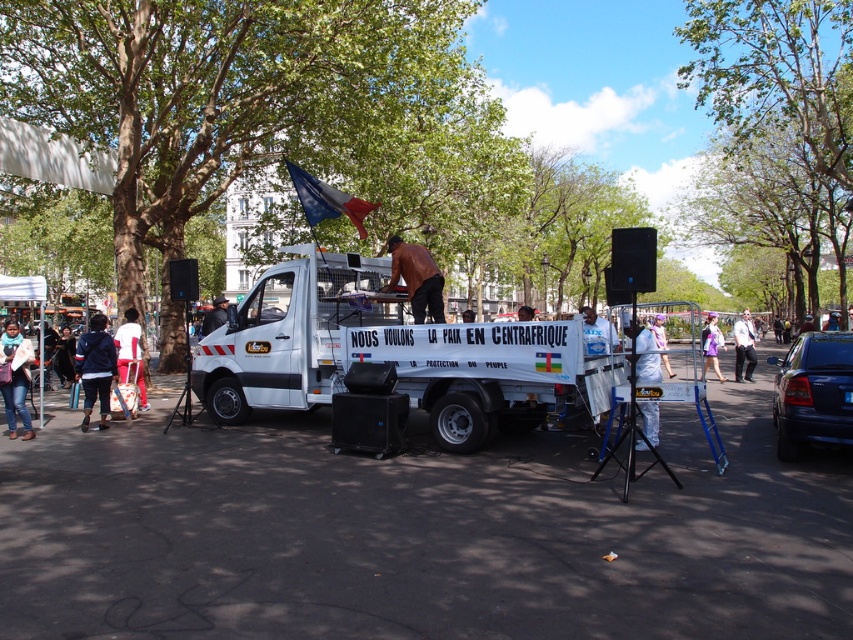
You are a photographer trying to capture a clear shot of the white matte food truck at center and the green leafy tree at upper center. Since you want both subjects in focus, you need to know which one is narrower. Which object is thinner?

The white matte food truck at center is thinner than the green leafy tree at upper center.

In the scene shown: You are a pedestrian standing at the jeans at lower left and want to reach the blue metallic sedan at right. Given that you can walk at 1.5 meters per second, how long will it take you to reach the sedan?

The distance between the blue metallic sedan at right and jeans at lower left is 11.32 meters. At a walking speed of 1.5 meters per second, it would take approximately 7.55 seconds to reach the sedan.